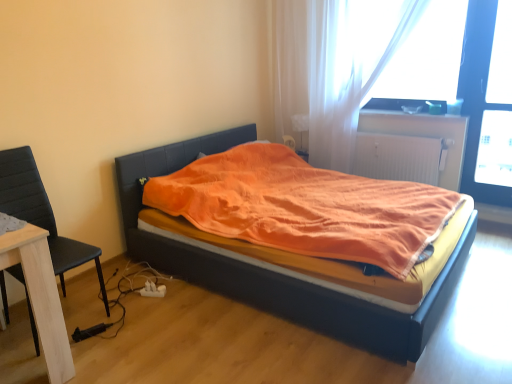
Question: Is orange fabric bed at center spatially inside white textured radiator at upper right, or outside of it?

Choices:
 (A) inside
 (B) outside

Answer: (B)

Question: From a real-world perspective, is orange fabric bed at center physically located above or below white textured radiator at upper right?

Choices:
 (A) below
 (B) above

Answer: (A)

Question: Which object is positioned closest to the transparent plastic window screen at upper right?

Choices:
 (A) white textured radiator at upper right
 (B) transparent glass screen door at upper right
 (C) translucent fabric curtain at upper right
 (D) orange fabric bed at center
 (E) black leather chair at left

Answer: (B)

Question: Estimate the real-world distances between objects in this image. Which object is farther from the white textured radiator at upper right?

Choices:
 (A) transparent glass screen door at upper right
 (B) translucent fabric curtain at upper right
 (C) transparent plastic window screen at upper right
 (D) orange fabric bed at center
 (E) black leather chair at left

Answer: (E)